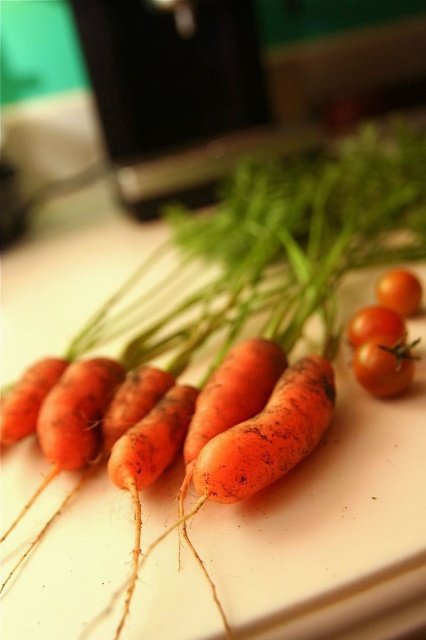
You are arranging vegetables on a cutting board and need to place a bowl to the left of the orange matte carrot at center. Based on the image, where should you position the bowl?

The orange matte carrot at center is located at point (26, 397), so you should place the bowl to the left of this coordinate.

You are arranging ingredients on a cutting board and need to place a new item between the glossy cherry tomato at center and the black object to the right. Where should you position the new item?

The glossy cherry tomato at center is located at point (374, 324), so you should position the new item to the right of the glossy cherry tomato at center but before reaching the black object to the right.

You are arranging vegetables on a cutting board and need to place a bowl to the left of the orange matte carrot at center. Based on the carrots and cherry tomatoes shown, where should you position the bowl relative to the carrot?

The orange matte carrot at center is located at point (26, 397), so you should place the bowl to the left of this coordinate to ensure it is positioned correctly relative to the carrot.